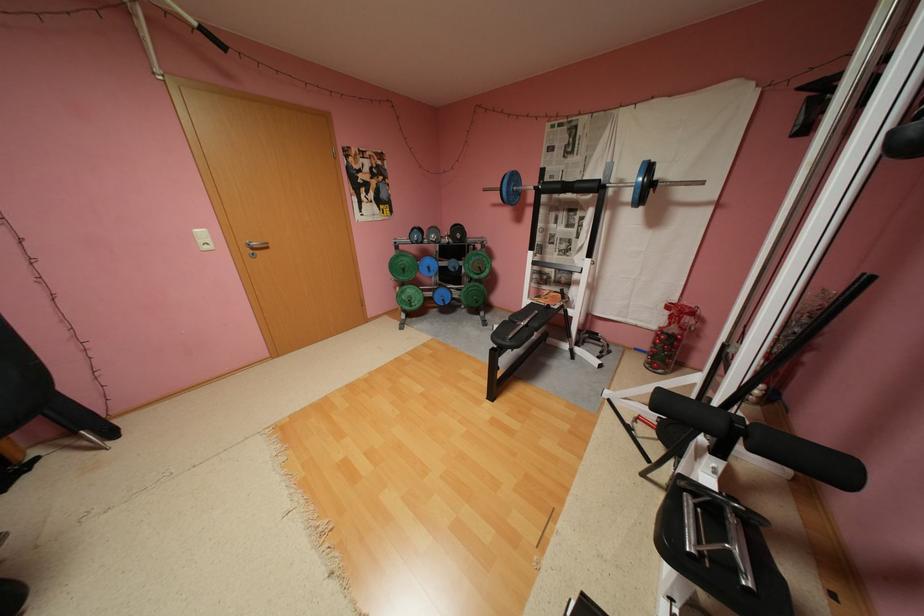
The width and height of the screenshot is (924, 616). Find the location of `black dumbbell`. black dumbbell is located at coordinates (453, 265).